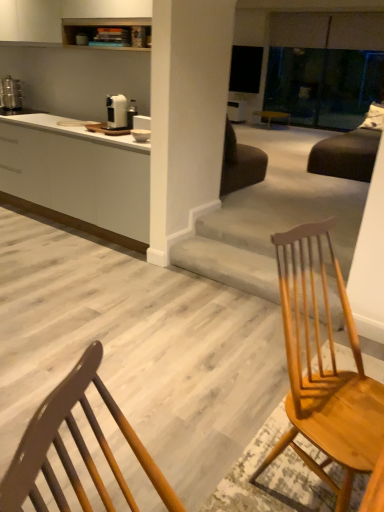
Question: Is white matte cabinet at left completely or partially outside of metallic silver toaster at left, marked as the second appliance in a bottom-to-top arrangement?

Choices:
 (A) yes
 (B) no

Answer: (A)

Question: Are white matte cabinet at left and metallic silver toaster at left, arranged as the 2th appliance when viewed from the front, beside each other?

Choices:
 (A) no
 (B) yes

Answer: (A)

Question: From the image's perspective, is white matte cabinet at left on top of metallic silver toaster at left, the 1th appliance viewed from the top?

Choices:
 (A) no
 (B) yes

Answer: (A)

Question: Does white matte cabinet at left appear on the left side of metallic silver toaster at left, marked as the second appliance in a bottom-to-top arrangement?

Choices:
 (A) no
 (B) yes

Answer: (A)

Question: Is white matte cabinet at left to the right of metallic silver toaster at left, the 1th appliance viewed from the top, from the viewer's perspective?

Choices:
 (A) yes
 (B) no

Answer: (A)

Question: Is the position of white matte cabinet at left more distant than that of metallic silver toaster at left, arranged as the 2th appliance when viewed from the front?

Choices:
 (A) no
 (B) yes

Answer: (A)

Question: Is light brown wood chair at center oriented towards white matte cabinet at left?

Choices:
 (A) no
 (B) yes

Answer: (A)

Question: Can you confirm if light brown wood chair at center is bigger than white matte cabinet at left?

Choices:
 (A) no
 (B) yes

Answer: (A)

Question: Is light brown wood chair at center directly adjacent to white matte cabinet at left?

Choices:
 (A) no
 (B) yes

Answer: (A)

Question: Could white matte cabinet at left be considered to be inside light brown wood chair at center?

Choices:
 (A) no
 (B) yes

Answer: (A)

Question: Can you confirm if light brown wood chair at center is thinner than white matte cabinet at left?

Choices:
 (A) yes
 (B) no

Answer: (A)

Question: Is light brown wood chair at center outside of white matte cabinet at left?

Choices:
 (A) yes
 (B) no

Answer: (A)

Question: Can we say satin silver toaster at upper center, placed as the 2th appliance when sorted from left to right, lies outside metallic silver toaster at left, which is counted as the first appliance, starting from the back?

Choices:
 (A) no
 (B) yes

Answer: (B)